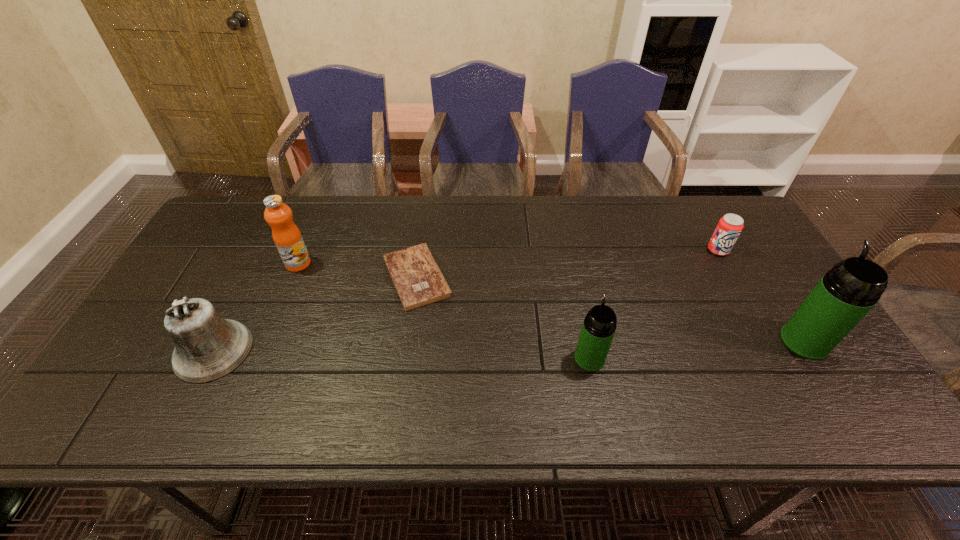
At what (x,y) coordinates should I click in order to perform the action: click on free point between the taller thermos bottle and the bell. Please return your answer as a coordinate pair (x, y). This screenshot has width=960, height=540. Looking at the image, I should click on (509, 346).

Identify the location of vacant space that's between the tallest object and the fruit juice. (551, 302).

Locate an element on the screen. The width and height of the screenshot is (960, 540). object that is the fifth closest to the third object from right to left is located at coordinates click(x=207, y=347).

The height and width of the screenshot is (540, 960). I want to click on object that stands as the third closest to the fifth tallest object, so click(x=418, y=280).